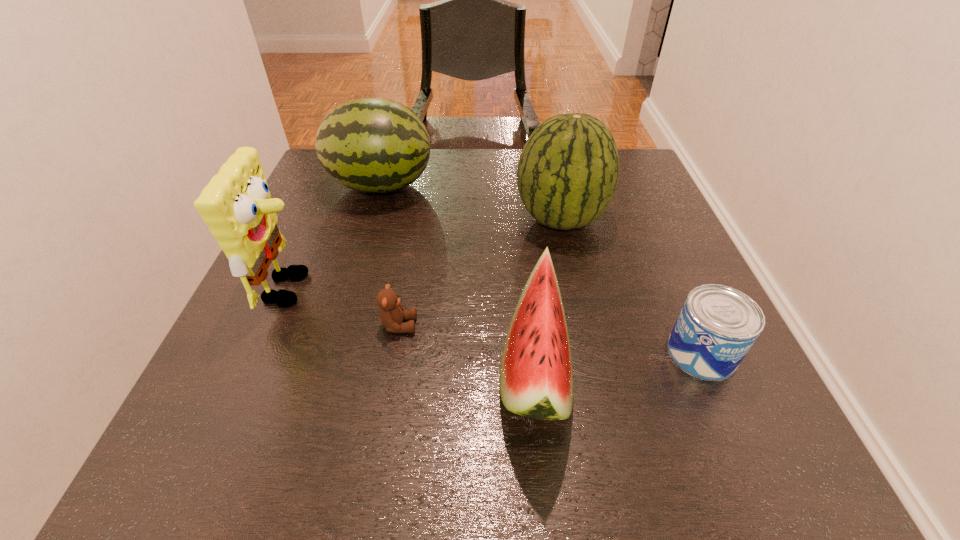
Locate an element on the screen. The height and width of the screenshot is (540, 960). blank region between the leftmost watermelon and the sponge is located at coordinates (336, 237).

Find the location of a particular element. Image resolution: width=960 pixels, height=540 pixels. free space between the sponge and the teddy bear is located at coordinates (345, 307).

Locate an element on the screen. The width and height of the screenshot is (960, 540). free area in between the teddy bear and the sponge is located at coordinates (345, 307).

At what (x,y) coordinates should I click in order to perform the action: click on unoccupied position between the shortest watermelon and the shortest object. Please return your answer as a coordinate pair (x, y). Looking at the image, I should click on (467, 347).

Find the location of a particular element. object that stands as the fifth closest to the fifth tallest object is located at coordinates (236, 205).

Select which object appears as the closest to the second shortest object. Please provide its 2D coordinates. Your answer should be formatted as a tuple, i.e. [(x, y)], where the tuple contains the x and y coordinates of a point satisfying the conditions above.

[(536, 376)]

This screenshot has height=540, width=960. I want to click on watermelon that is the nearest to the nearest watermelon, so click(x=567, y=174).

Find the location of a particular element. watermelon that is the second nearest to the shortest object is located at coordinates [x=567, y=174].

Where is `free region that satisfies the following two spatial constraints: 1. on the front label of the can; 2. on the outer rind of the shortest watermelon`? The image size is (960, 540). free region that satisfies the following two spatial constraints: 1. on the front label of the can; 2. on the outer rind of the shortest watermelon is located at coordinates (708, 369).